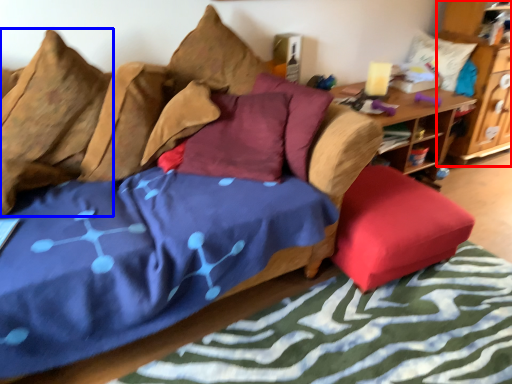
Question: Which object is further to the camera taking this photo, cabinetry (highlighted by a red box) or pillow (highlighted by a blue box)?

Choices:
 (A) cabinetry
 (B) pillow

Answer: (A)